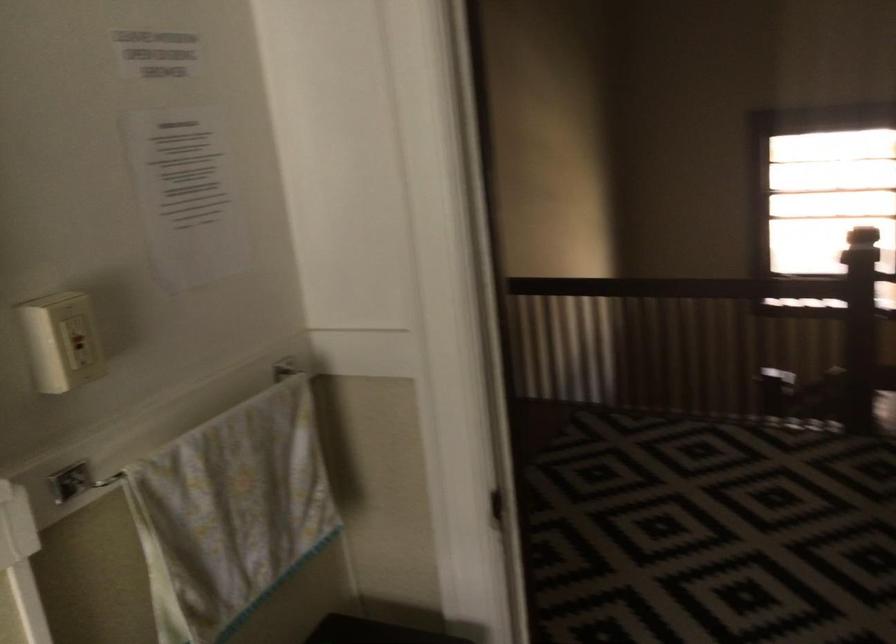
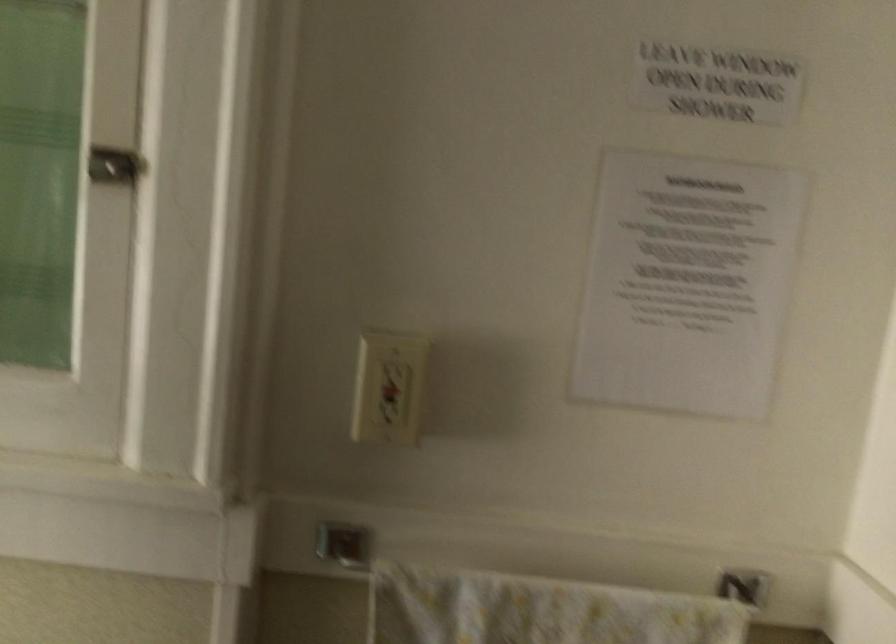
In the second image, find the point that corresponds to pixel 82 337 in the first image.

(389, 388)